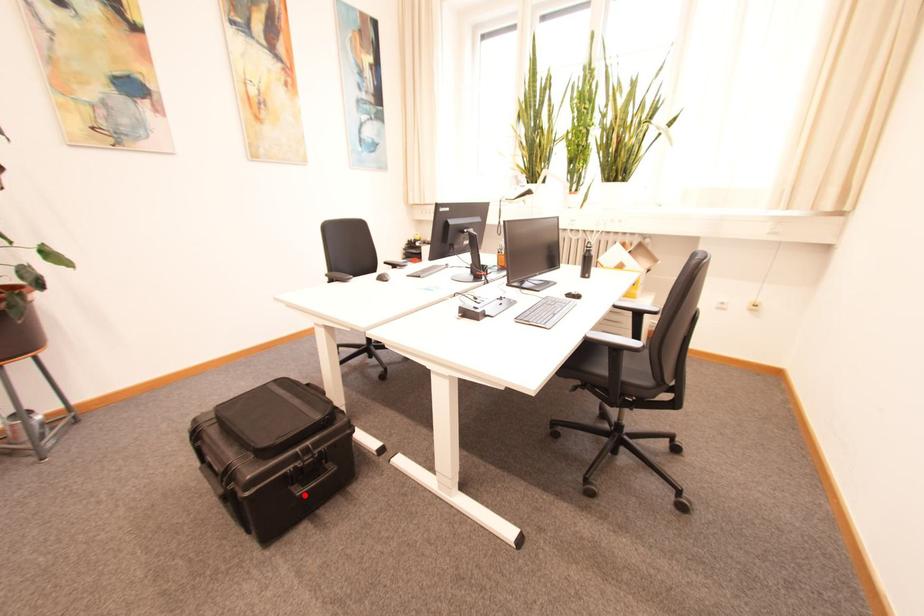
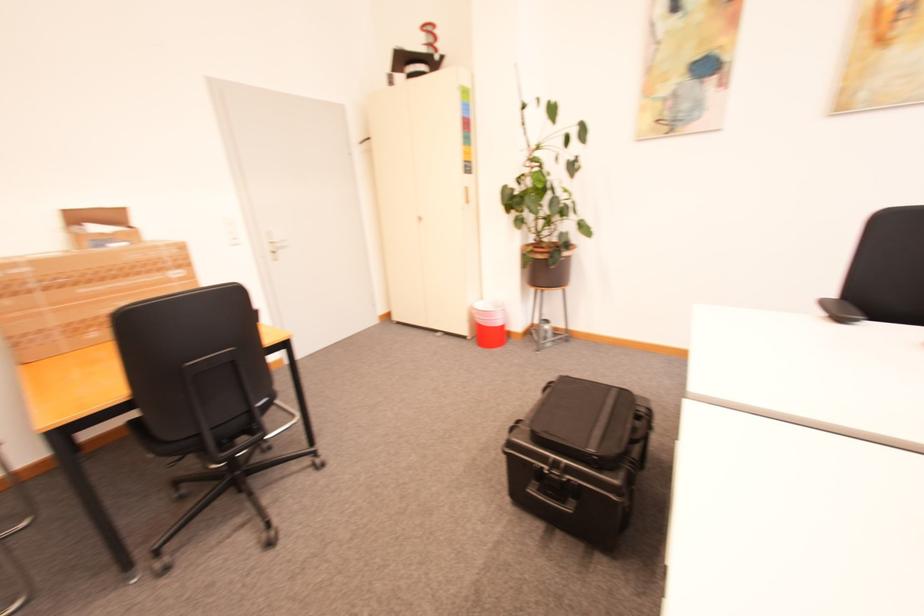
Question: I am providing you with two images of the same scene from different viewpoints. Given a red point in image1, look at the same physical point in image2. Is it:

Choices:
 (A) Closer to the viewpoint
 (B) Farther from the viewpoint

Answer: (B)